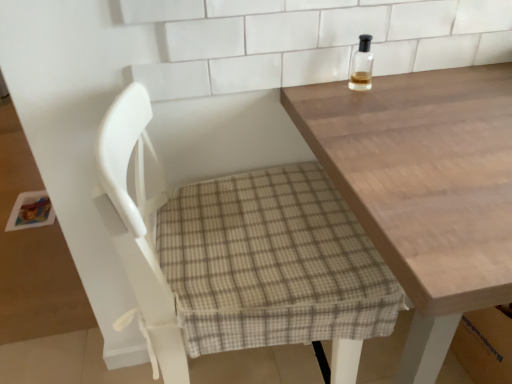
Image resolution: width=512 pixels, height=384 pixels. In order to click on vacant space in front of clear glass bottle at upper right in this screenshot , I will do `click(383, 121)`.